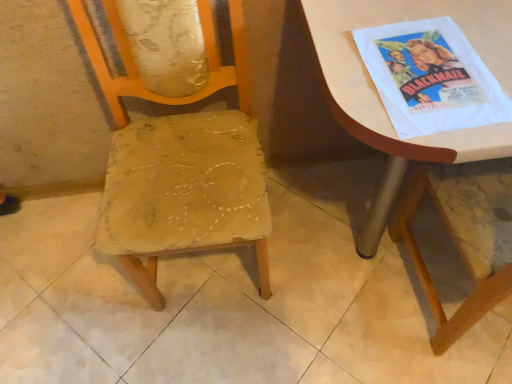
You are a GUI agent. You are given a task and a screenshot of the screen. Output one action in this format:
    pyautogui.click(x=<x>, y=<y>)
    Task: Click on the free point above white paper poster at upper right (from a real-world perspective)
    
    Given the screenshot: What is the action you would take?
    pyautogui.click(x=428, y=66)